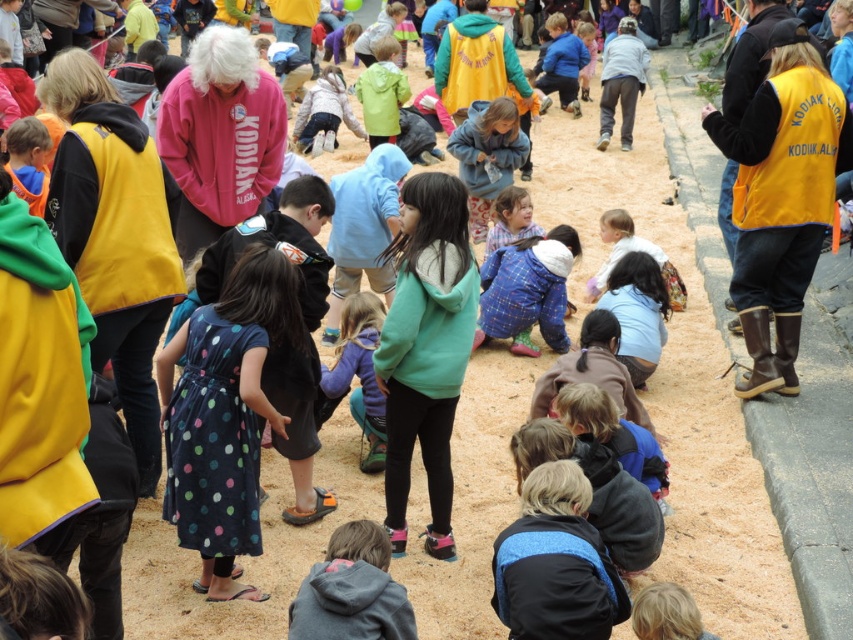
Question: Which object is the farthest from the blue fleece jacket at center?

Choices:
 (A) pink fleece jacket at center
 (B) gray fleece hoodie at lower center

Answer: (B)

Question: Can you confirm if pink fleece jacket at center is wider than green matte jacket at center?

Choices:
 (A) yes
 (B) no

Answer: (A)

Question: Which of the following is the closest to the observer?

Choices:
 (A) (363, 406)
 (B) (370, 573)
 (C) (374, 49)

Answer: (B)

Question: Which point is farther to the camera?

Choices:
 (A) 387,44
 (B) 190,221
 (C) 299,148

Answer: (C)

Question: Is blue fleece jacket at center below light blue fabric at center?

Choices:
 (A) yes
 (B) no

Answer: (A)

Question: Where is pink fleece jacket at center located in relation to gray fleece hoodie at lower center in the image?

Choices:
 (A) right
 (B) left

Answer: (B)